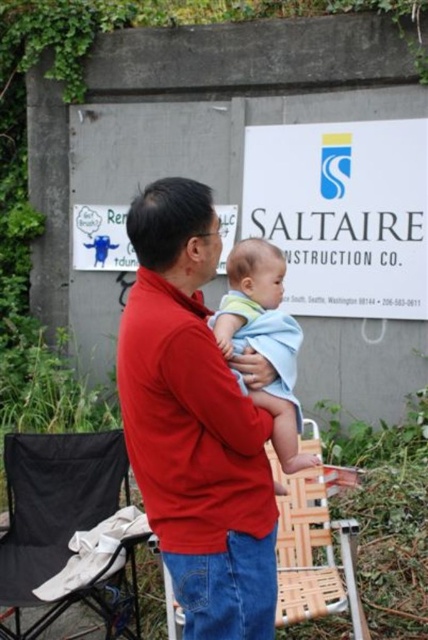
Question: Among these objects, which one is farthest from the camera?

Choices:
 (A) black fabric folding chair at lower left
 (B) wooden at center
 (C) red cotton shirt at center

Answer: (A)

Question: Among these points, which one is farthest from the camera?

Choices:
 (A) (177, 448)
 (B) (47, 476)

Answer: (B)

Question: Estimate the real-world distances between objects in this image. Which object is closer to the black fabric folding chair at lower left?

Choices:
 (A) blue cotton baby at center
 (B) red cotton shirt at center

Answer: (A)

Question: Can you confirm if red cotton shirt at center is wider than black fabric folding chair at lower left?

Choices:
 (A) no
 (B) yes

Answer: (A)

Question: Is wooden at center positioned at the back of blue cotton baby at center?

Choices:
 (A) yes
 (B) no

Answer: (A)

Question: Does red cotton shirt at center have a larger size compared to blue cotton baby at center?

Choices:
 (A) yes
 (B) no

Answer: (B)